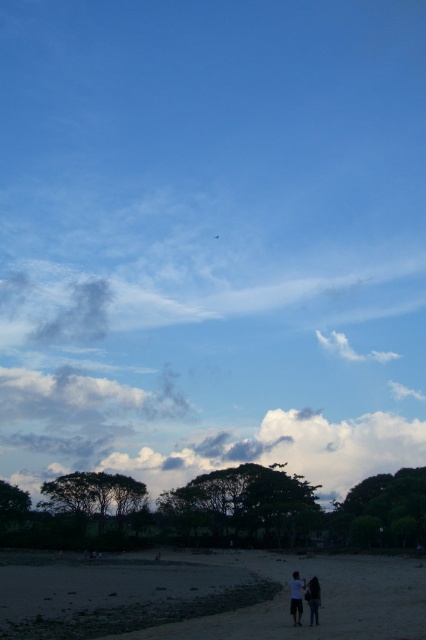
Question: Can you confirm if dark blue jeans at lower center is bigger than white cotton shirt at lower center?

Choices:
 (A) yes
 (B) no

Answer: (B)

Question: From the image, what is the correct spatial relationship of sandy beach at lower center in relation to white cotton shirt at lower center?

Choices:
 (A) right
 (B) left

Answer: (B)

Question: Which object appears closest to the camera in this image?

Choices:
 (A) green leafy tree at lower right
 (B) dark green leafy tree at center

Answer: (A)

Question: Which of the following is the closest to the observer?

Choices:
 (A) jeans at lower right
 (B) dark blue jeans at lower center
 (C) white cotton shirt at lower center
 (D) white fluffy cloud at upper center

Answer: (C)

Question: Which point appears farthest from the camera in this image?

Choices:
 (A) coord(301,605)
 (B) coord(311,580)
 (C) coord(92,476)
 (D) coord(256,490)

Answer: (C)

Question: Is the position of jeans at lower right less distant than that of white fluffy cloud at upper center?

Choices:
 (A) no
 (B) yes

Answer: (B)